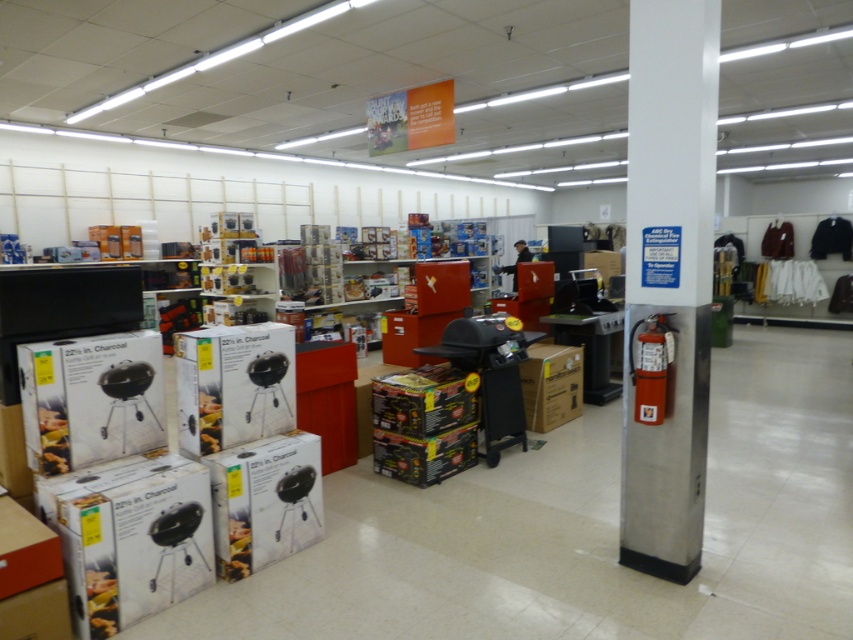
Question: Which of the following is the closest to the observer?

Choices:
 (A) [x=525, y=381]
 (B) [x=270, y=520]
 (C) [x=234, y=337]
 (D) [x=703, y=147]

Answer: (D)

Question: Which point is farther from the camera taking this photo?

Choices:
 (A) (38, 346)
 (B) (259, 518)
 (C) (196, 348)

Answer: (B)

Question: Is white metallic pillar at center below white matte grill at left?

Choices:
 (A) no
 (B) yes

Answer: (A)

Question: Among these points, which one is farthest from the camera?

Choices:
 (A) [x=218, y=570]
 (B) [x=181, y=353]
 (C) [x=157, y=381]
 (D) [x=529, y=412]

Answer: (D)

Question: Does white cardboard box at lower left have a lesser width compared to white matte grill at lower left?

Choices:
 (A) yes
 (B) no

Answer: (B)

Question: Is white cardboard box at center wider than brown cardboard box at center?

Choices:
 (A) no
 (B) yes

Answer: (A)